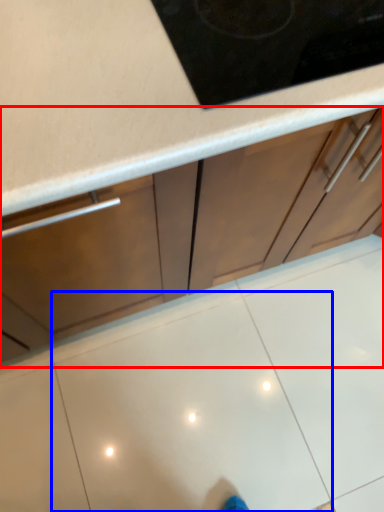
Question: Which of the following is the farthest to the observer, cabinetry (highlighted by a red box) or tile (highlighted by a blue box)?

Choices:
 (A) cabinetry
 (B) tile

Answer: (B)